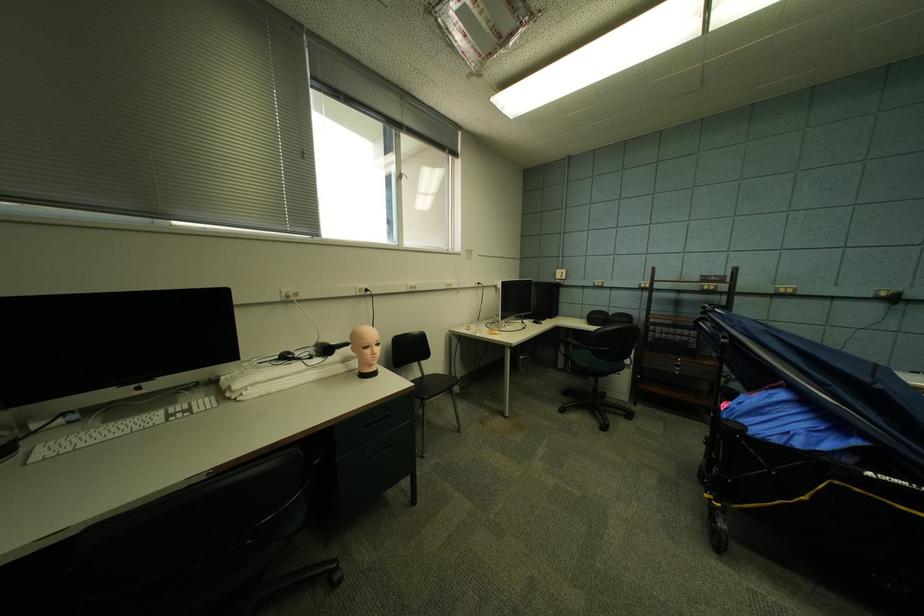
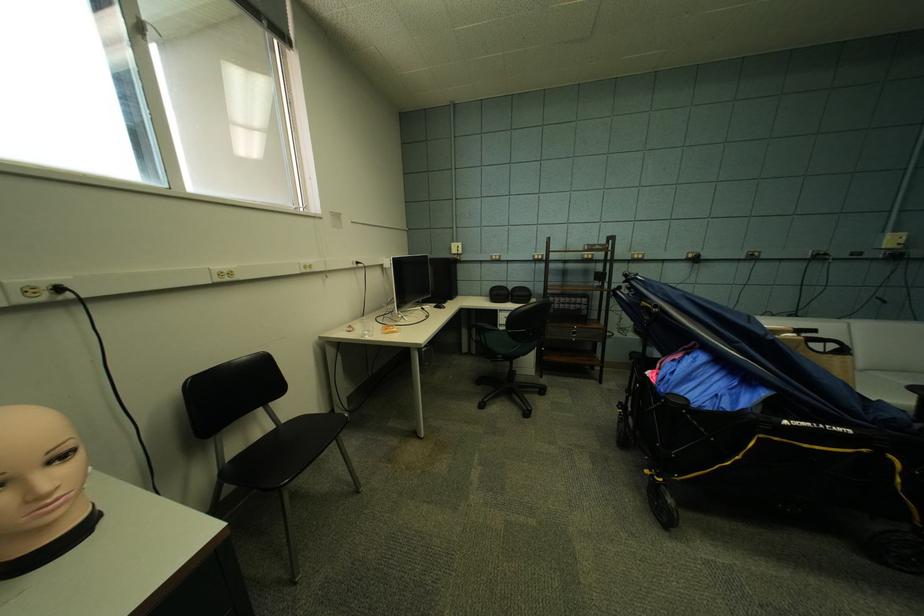
Question: What movement of the cameraman would produce the second image?

Choices:
 (A) Left
 (B) Right
 (C) Forward
 (D) Backward

Answer: (C)